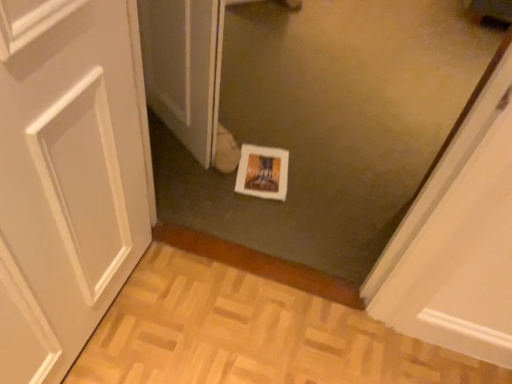
Identify the location of free space below white glossy print at center (from a real-world perspective). This screenshot has height=384, width=512. (264, 172).